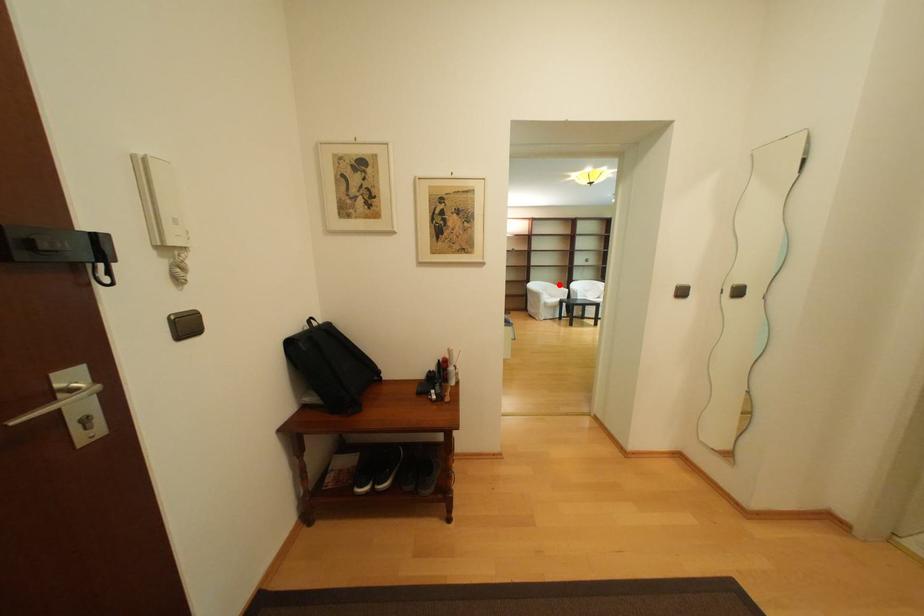
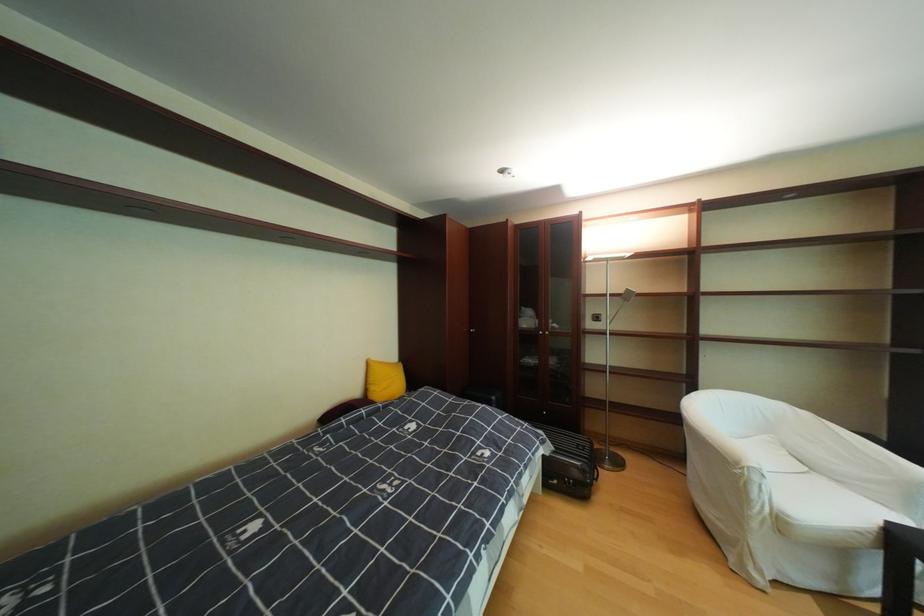
Locate, in the second image, the point that corresponds to the highlighted location in the first image.

(793, 407)